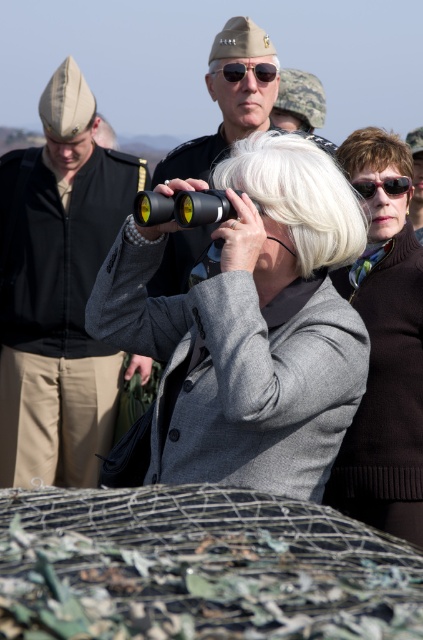
Does matte gray sweater at center appear on the left side of white matte wig at center?

In fact, matte gray sweater at center is to the right of white matte wig at center.

Between point (334, 502) and point (263, 189), which one is positioned behind?

The point (334, 502) is behind.

Where is `matte gray sweater at center`? matte gray sweater at center is located at coordinates (386, 378).

Does brushed metal hat at left have a greater height compared to matte black sunglasses at upper center?

Yes, brushed metal hat at left is taller than matte black sunglasses at upper center.

Where is `brushed metal hat at left`? Image resolution: width=423 pixels, height=640 pixels. brushed metal hat at left is located at coordinates (57, 291).

Locate an element on the screen. Image resolution: width=423 pixels, height=640 pixels. brushed metal hat at left is located at coordinates (57, 291).

Is gray matte jacket at center bigger than black plastic sunglasses at upper center?

Yes.

Does gray matte jacket at center appear on the right side of black plastic sunglasses at upper center?

Incorrect, gray matte jacket at center is not on the right side of black plastic sunglasses at upper center.

Who is more distant from viewer, (216, 445) or (357, 186)?

Positioned behind is point (357, 186).

The image size is (423, 640). I want to click on gray matte jacket at center, so click(249, 326).